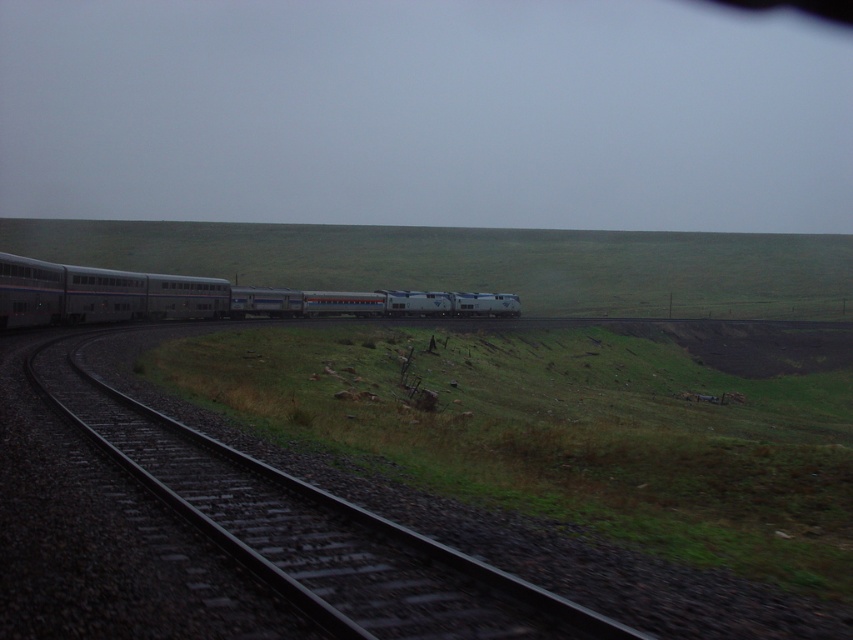
Based on the photo, can you confirm if black metal track at center is wider than silver metallic train at center?

No.

Is point (109, 403) closer to camera compared to point (218, 307)?

Yes.

Is point (236, 452) positioned before point (302, 305)?

Yes, it is in front of point (302, 305).

Image resolution: width=853 pixels, height=640 pixels. I want to click on black metal track at center, so click(306, 529).